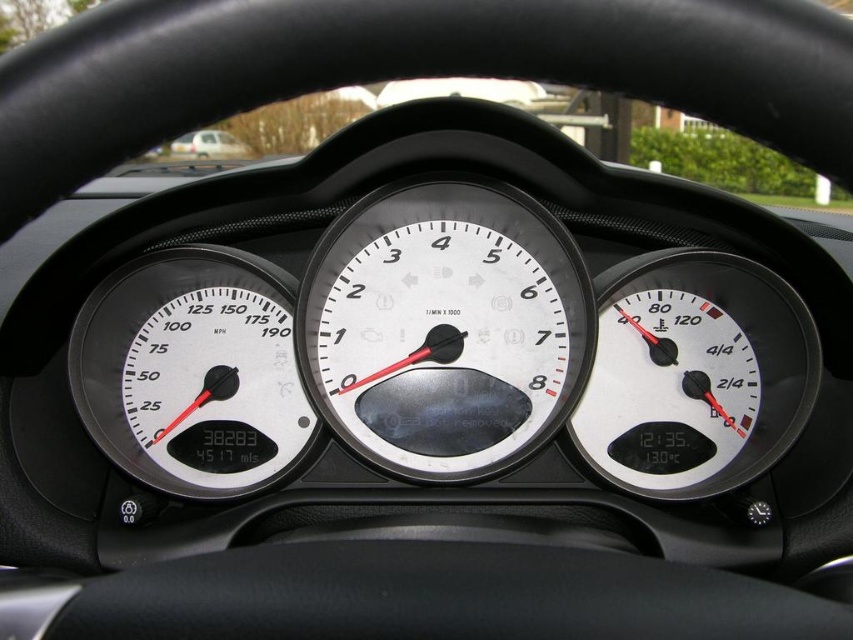
Question: Which object appears closest to the camera in this image?

Choices:
 (A) white matte van at upper center
 (B) white glossy speedometer at left

Answer: (B)

Question: Where is white matte tachometer at center located in relation to white matte fuel gauge at center right in the image?

Choices:
 (A) above
 (B) below

Answer: (A)

Question: Can you confirm if white matte tachometer at center is positioned to the left of white matte van at upper center?

Choices:
 (A) yes
 (B) no

Answer: (B)

Question: Does white matte tachometer at center have a smaller size compared to white glossy speedometer at left?

Choices:
 (A) no
 (B) yes

Answer: (A)

Question: Considering the real-world distances, which object is farthest from the white matte fuel gauge at center right?

Choices:
 (A) white matte tachometer at center
 (B) white glossy speedometer at left

Answer: (B)

Question: Among these objects, which one is farthest from the camera?

Choices:
 (A) white matte tachometer at center
 (B) white glossy speedometer at left
 (C) white matte van at upper center

Answer: (C)